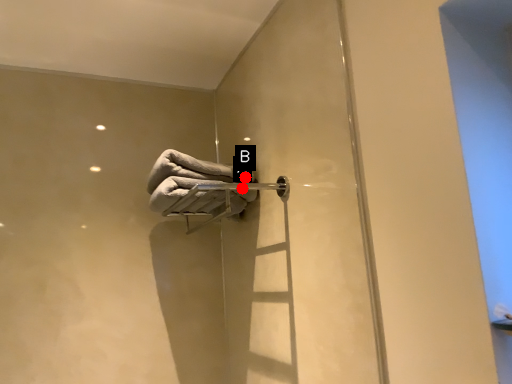
Question: Two points are circled on the image, labeled by A and B beside each circle. Which of the following is the closest to the observer?

Choices:
 (A) A is closer
 (B) B is closer

Answer: (A)